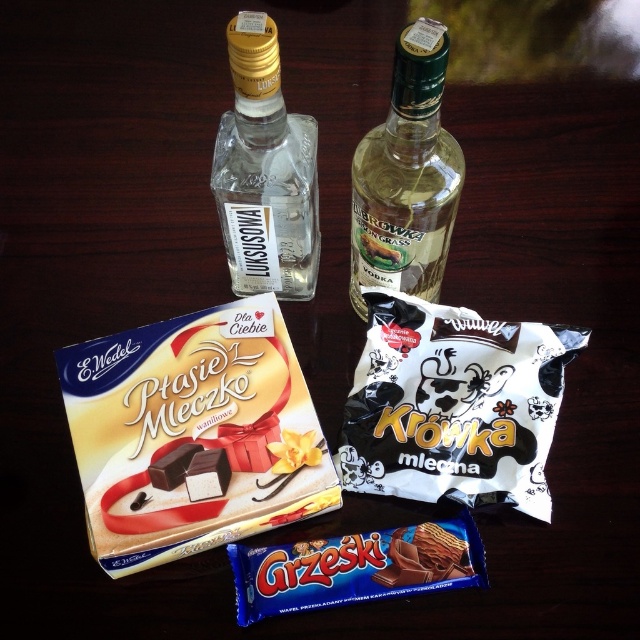
You are organizing a snack table and want to place the white matte krowka mleczna at center and the chocolate wafer at center. Which one is on top?

The white matte krowka mleczna at center is positioned over chocolate wafer at center, so it is on top.

You are organizing items on a shelf and need to place the chocolate wafer at center and the white matte krowka mleczna at center. Based on their positions in the image, which item is closer to the front of the shelf?

The white matte krowka mleczna at center is closer to the front of the shelf because the chocolate wafer at center is positioned behind it.

You are a delivery person who needs to place a small package on the table. The package must be placed at the exact point marked as point [394,428]. You are currently standing 1.2 meters away from the table. Can you reach the point without moving closer to the table?

The distance of point [394,428] from camera is 1.07 meters. Since you are currently 1.2 meters away from the table, you are farther than the required point. Therefore, you cannot reach the point without moving closer to the table.